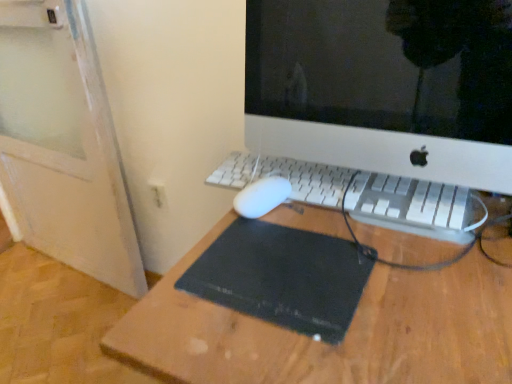
Question: Considering the relative positions of white plastic computer monitor at center and white plastic electric outlet at lower left in the image provided, is white plastic computer monitor at center to the left of white plastic electric outlet at lower left from the viewer's perspective?

Choices:
 (A) yes
 (B) no

Answer: (B)

Question: From a real-world perspective, is white plastic computer monitor at center located beneath white plastic electric outlet at lower left?

Choices:
 (A) yes
 (B) no

Answer: (B)

Question: Is white plastic computer monitor at center far away from white plastic electric outlet at lower left?

Choices:
 (A) no
 (B) yes

Answer: (A)

Question: Is white plastic electric outlet at lower left located within white plastic computer monitor at center?

Choices:
 (A) no
 (B) yes

Answer: (A)

Question: Does white plastic computer monitor at center have a greater height compared to white plastic electric outlet at lower left?

Choices:
 (A) no
 (B) yes

Answer: (B)

Question: Would you say white plastic computer monitor at center is to the left or to the right of black rubber mousepad at center in the picture?

Choices:
 (A) left
 (B) right

Answer: (B)

Question: From a real-world perspective, is white plastic computer monitor at center above or below black rubber mousepad at center?

Choices:
 (A) above
 (B) below

Answer: (A)

Question: Considering their positions, is white plastic computer monitor at center located in front of or behind black rubber mousepad at center?

Choices:
 (A) behind
 (B) front

Answer: (B)

Question: Choose the correct answer: Is white plastic computer monitor at center inside black rubber mousepad at center or outside it?

Choices:
 (A) inside
 (B) outside

Answer: (B)

Question: From a real-world perspective, is white plastic electric outlet at lower left positioned above or below black rubber mousepad at center?

Choices:
 (A) below
 (B) above

Answer: (A)

Question: Would you say white plastic electric outlet at lower left is to the left or to the right of black rubber mousepad at center in the picture?

Choices:
 (A) right
 (B) left

Answer: (B)

Question: From the image's perspective, is white plastic electric outlet at lower left above or below black rubber mousepad at center?

Choices:
 (A) below
 (B) above

Answer: (B)

Question: Is white plastic electric outlet at lower left bigger or smaller than black rubber mousepad at center?

Choices:
 (A) big
 (B) small

Answer: (B)

Question: Is white plastic keyboard at center to the left or to the right of white plastic computer monitor at center in the image?

Choices:
 (A) right
 (B) left

Answer: (B)

Question: From the image's perspective, is white plastic keyboard at center positioned above or below white plastic computer monitor at center?

Choices:
 (A) above
 (B) below

Answer: (B)